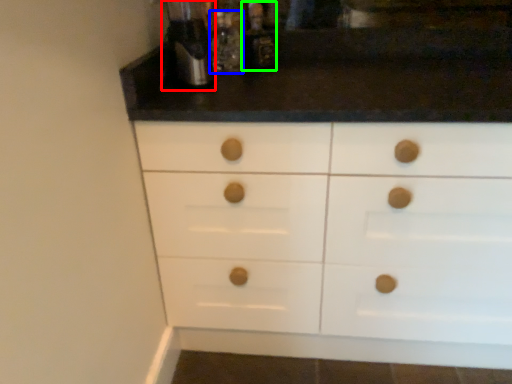
Question: Which object is positioned farthest from coffee machine (highlighted by a red box)? Select from bottle (highlighted by a blue box) and bottle (highlighted by a green box).

Choices:
 (A) bottle
 (B) bottle

Answer: (B)